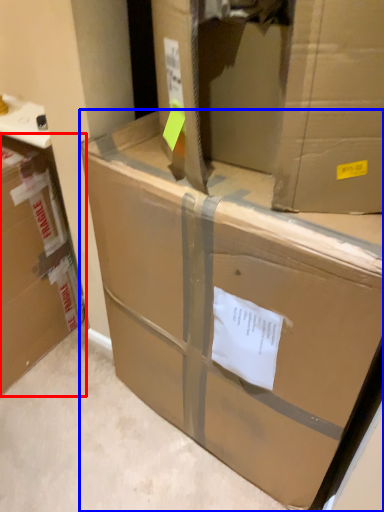
Question: Which object appears closest to the camera in this image, box (highlighted by a red box) or box (highlighted by a blue box)?

Choices:
 (A) box
 (B) box

Answer: (B)